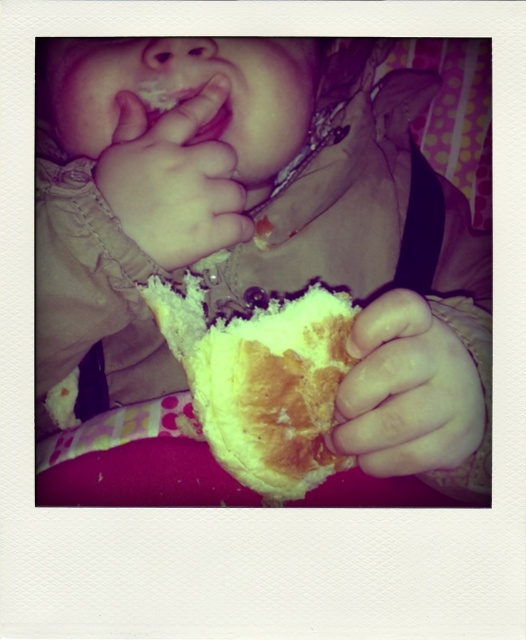
You are a photographer trying to capture the child holding the bread. To ensure the soft white bread at center is clearly visible, should you adjust your camera focus to prioritize the smooth beige hand at upper left or the bread?

The soft white bread at center is positioned under the smooth beige hand at upper left, so focusing on the bread would require adjusting the focus downward from the hand to ensure it is in clear view.

You are a baker who needs to package two types of bread. The soft white bread at center and the smooth white bread at lower right. Which bread should you choose if you have a box that can only fit the narrower one?

The smooth white bread at lower right is narrower than the soft white bread at center, so you should choose the smooth white bread at lower right for the box.

You are a chef preparing a meal and need to place the smooth white bread at lower right and the smooth beige hand at upper left on a plate. The plate has a diameter of 9 inches. Can both items fit on the plate without overlapping?

The smooth white bread at lower right is 7.47 inches away from the smooth beige hand at upper left. Since the plate has a diameter of 9 inches, which is larger than the distance between them, both items can fit on the plate without overlapping.